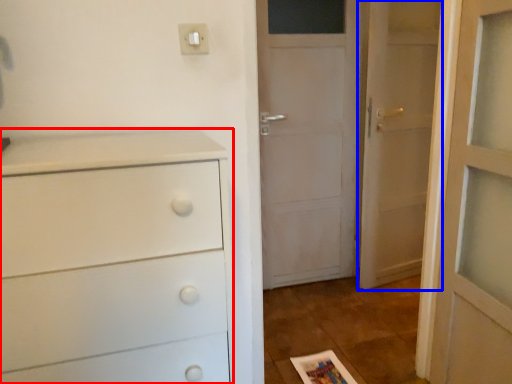
Question: Which object appears closest to the camera in this image, chest of drawers (highlighted by a red box) or door (highlighted by a blue box)?

Choices:
 (A) chest of drawers
 (B) door

Answer: (A)